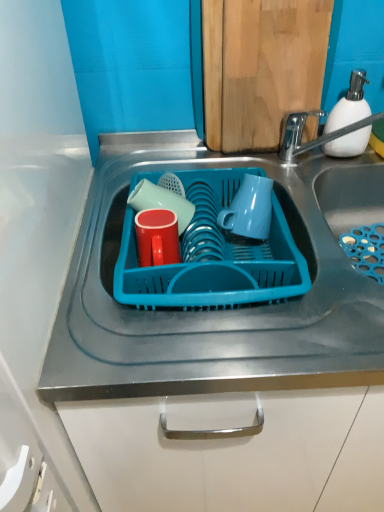
Question: Is blue plastic tray at center outside matte red cup at center, which is counted as the 2th tableware, starting from the front?

Choices:
 (A) no
 (B) yes

Answer: (B)

Question: Is blue plastic tray at center in contact with matte red cup at center, which is counted as the 2th tableware, starting from the front?

Choices:
 (A) yes
 (B) no

Answer: (B)

Question: From a real-world perspective, is blue plastic tray at center positioned over matte red cup at center, the first tableware in the back-to-front sequence, based on gravity?

Choices:
 (A) no
 (B) yes

Answer: (A)

Question: Considering the relative sizes of blue plastic tray at center and matte red cup at center, the first tableware in the back-to-front sequence, in the image provided, is blue plastic tray at center wider than matte red cup at center, the first tableware in the back-to-front sequence,?

Choices:
 (A) yes
 (B) no

Answer: (A)

Question: Is matte red cup at center, which is counted as the 2th tableware, starting from the front, completely or partially inside blue plastic tray at center?

Choices:
 (A) yes
 (B) no

Answer: (A)

Question: In the image, is matte red cup at center, which is counted as the 2th tableware, starting from the front, positioned in front of or behind matte blue mug at center?

Choices:
 (A) front
 (B) behind

Answer: (B)

Question: Considering the positions of matte red cup at center, which is counted as the 2th tableware, starting from the front, and matte blue mug at center in the image, is matte red cup at center, which is counted as the 2th tableware, starting from the front, taller or shorter than matte blue mug at center?

Choices:
 (A) short
 (B) tall

Answer: (A)

Question: Would you say matte red cup at center, the first tableware in the back-to-front sequence, is to the left or to the right of matte blue mug at center in the picture?

Choices:
 (A) right
 (B) left

Answer: (B)

Question: In terms of width, does matte red cup at center, which is counted as the 2th tableware, starting from the front, look wider or thinner when compared to matte blue mug at center?

Choices:
 (A) thin
 (B) wide

Answer: (A)

Question: Which is correct: matte red cup at center, the second tableware positioned from the back, is inside blue plastic tray at center, or outside of it?

Choices:
 (A) inside
 (B) outside

Answer: (A)

Question: Looking at their shapes, would you say matte red cup at center, the first tableware in the front-to-back sequence, is wider or thinner than blue plastic tray at center?

Choices:
 (A) thin
 (B) wide

Answer: (A)

Question: From the image's perspective, relative to blue plastic tray at center, is matte red cup at center, the first tableware in the front-to-back sequence, above or below?

Choices:
 (A) below
 (B) above

Answer: (B)

Question: From their relative heights in the image, would you say matte red cup at center, the first tableware in the front-to-back sequence, is taller or shorter than blue plastic tray at center?

Choices:
 (A) tall
 (B) short

Answer: (B)

Question: Is point (359, 144) positioned closer to the camera than point (195, 210)?

Choices:
 (A) farther
 (B) closer

Answer: (A)

Question: In the image, is white matte soap dispenser at upper right positioned in front of or behind blue plastic basket at center?

Choices:
 (A) behind
 (B) front

Answer: (A)